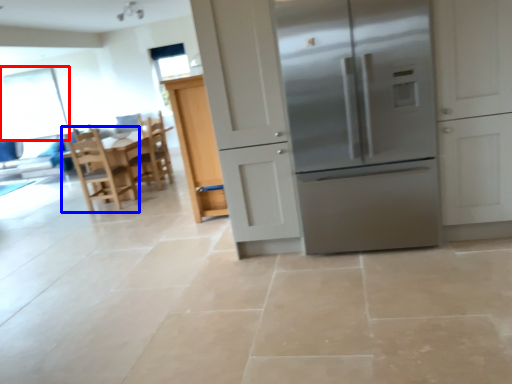
Question: Which of the following is the farthest to the observer, window screen (highlighted by a red box) or chair (highlighted by a blue box)?

Choices:
 (A) window screen
 (B) chair

Answer: (A)